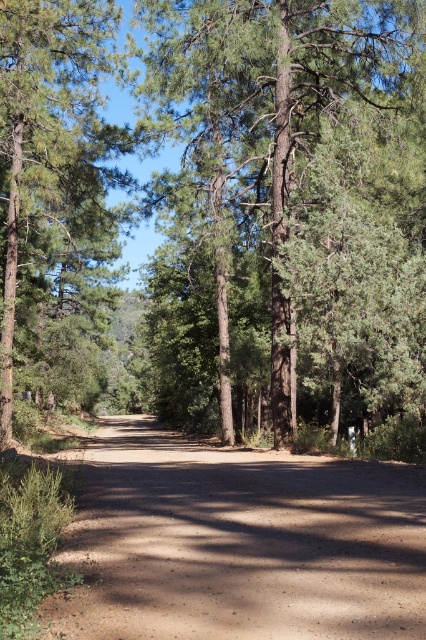
Question: Which is farther from the brown gravel road at center?

Choices:
 (A) green textured tree at center
 (B) green matte tree at left

Answer: (B)

Question: Is green textured tree at center to the right of brown gravel road at center from the viewer's perspective?

Choices:
 (A) yes
 (B) no

Answer: (A)

Question: Is green textured tree at center bigger than brown gravel road at center?

Choices:
 (A) yes
 (B) no

Answer: (A)

Question: Estimate the real-world distances between objects in this image. Which object is farther from the green matte tree at left?

Choices:
 (A) green textured tree at center
 (B) brown gravel road at center

Answer: (B)

Question: Among these points, which one is farthest from the camera?

Choices:
 (A) (97, 490)
 (B) (290, 77)
 (C) (72, 141)

Answer: (B)

Question: Can you confirm if green textured tree at center is thinner than brown gravel road at center?

Choices:
 (A) no
 (B) yes

Answer: (A)